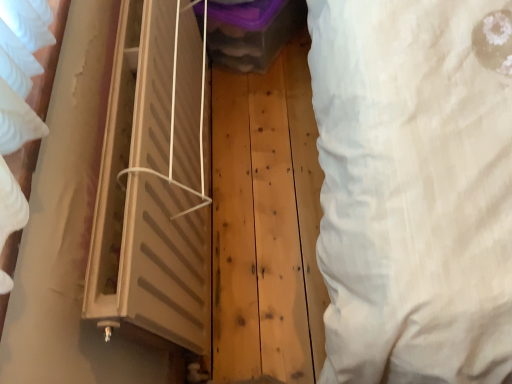
This screenshot has width=512, height=384. What are the coordinates of `beige plastic window at center` in the screenshot? It's located at tap(154, 181).

Describe the element at coordinates (154, 181) in the screenshot. The width and height of the screenshot is (512, 384). I see `beige plastic window at center` at that location.

This screenshot has height=384, width=512. What do you see at coordinates (412, 193) in the screenshot? I see `white fabric curtain at right` at bounding box center [412, 193].

This screenshot has width=512, height=384. What are the coordinates of `white fabric curtain at right` in the screenshot? It's located at [412, 193].

Where is `beige plastic window at center`? This screenshot has height=384, width=512. beige plastic window at center is located at coordinates (154, 181).

Considering the relative positions of beige plastic window at center and white fabric curtain at right in the image provided, is beige plastic window at center to the left or to the right of white fabric curtain at right?

From the image, it's evident that beige plastic window at center is to the left of white fabric curtain at right.

Does beige plastic window at center lie behind white fabric curtain at right?

Yes, beige plastic window at center is behind white fabric curtain at right.

Between point (189, 313) and point (354, 37), which one is positioned behind?

The point (189, 313) is farther from the camera.

From the image's perspective, does beige plastic window at center appear lower than white fabric curtain at right?

Yes, from the image's perspective, beige plastic window at center is below white fabric curtain at right.

From a real-world perspective, between beige plastic window at center and white fabric curtain at right, who is vertically lower?

From a 3D spatial view, beige plastic window at center is below.

Is beige plastic window at center wider or thinner than white fabric curtain at right?

Considering their sizes, beige plastic window at center looks broader than white fabric curtain at right.

In terms of height, does beige plastic window at center look taller or shorter compared to white fabric curtain at right?

beige plastic window at center is shorter than white fabric curtain at right.

Considering the sizes of objects beige plastic window at center and white fabric curtain at right in the image provided, who is smaller, beige plastic window at center or white fabric curtain at right?

With smaller size is white fabric curtain at right.

Is beige plastic window at center situated inside white fabric curtain at right or outside?

beige plastic window at center is outside white fabric curtain at right.

Can you see beige plastic window at center touching white fabric curtain at right?

No, beige plastic window at center is not beside white fabric curtain at right.

Is beige plastic window at center facing towards white fabric curtain at right?

Yes, beige plastic window at center is turned towards white fabric curtain at right.

Consider the image. How different are the orientations of beige plastic window at center and white fabric curtain at right in degrees?

beige plastic window at center and white fabric curtain at right are facing 0.994 degrees away from each other.

Identify the location of curtain in front of the beige plastic window at center. The width and height of the screenshot is (512, 384). (412, 193).

Can you confirm if white fabric curtain at right is positioned to the right of beige plastic window at center?

Indeed, white fabric curtain at right is positioned on the right side of beige plastic window at center.

Relative to beige plastic window at center, is white fabric curtain at right in front or behind?

In the image, white fabric curtain at right appears in front of beige plastic window at center.

Does point (506, 324) lie behind point (177, 197)?

That is False.

From the image's perspective, who appears lower, white fabric curtain at right or beige plastic window at center?

beige plastic window at center is shown below in the image.

From a real-world perspective, which is physically above, white fabric curtain at right or beige plastic window at center?

white fabric curtain at right is physically above.

Considering the relative sizes of white fabric curtain at right and beige plastic window at center in the image provided, is white fabric curtain at right wider than beige plastic window at center?

No, white fabric curtain at right is not wider than beige plastic window at center.

Who is taller, white fabric curtain at right or beige plastic window at center?

With more height is white fabric curtain at right.

Which of these two, white fabric curtain at right or beige plastic window at center, is smaller?

white fabric curtain at right.

Would you say white fabric curtain at right is outside beige plastic window at center?

white fabric curtain at right lies outside beige plastic window at center's area.

Is white fabric curtain at right positioned far away from beige plastic window at center?

Actually, white fabric curtain at right and beige plastic window at center are a little close together.

Does white fabric curtain at right turn towards beige plastic window at center?

Yes, white fabric curtain at right is turned towards beige plastic window at center.

You are a GUI agent. You are given a task and a screenshot of the screen. Output one action in this format:
    pyautogui.click(x=<x>, y=<y>)
    Task: Click on the window located below the white fabric curtain at right (from the image's perspective)
    The image size is (512, 384).
    Given the screenshot: What is the action you would take?
    pyautogui.click(x=154, y=181)

The width and height of the screenshot is (512, 384). Find the location of `curtain above the beige plastic window at center (from the image's perspective)`. curtain above the beige plastic window at center (from the image's perspective) is located at coordinates (412, 193).

I want to click on curtain in front of the beige plastic window at center, so click(x=412, y=193).